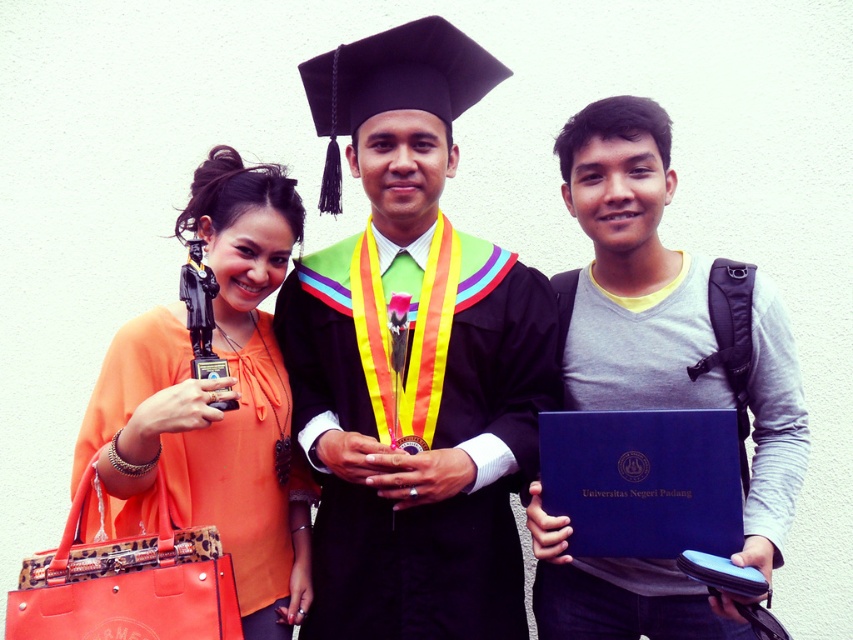
You are standing at the point labeled point (492, 65) and want to move to the graduation ceremony stage located 10 feet away from you. If you walk straight ahead, will you reach the stage before the graduation graduate?

The point labeled point (492, 65) is 7.42 feet away from the viewer. Since the stage is 10 feet away, walking straight ahead will allow you to reach the stage before the graduation graduate, as 7.42 feet is less than 10 feet.

You are standing in front of the image and want to know how far the point at coordinates (401, 472) is from you. Can you determine the distance?

The point at coordinates (401, 472) is 2.02 meters away from you.